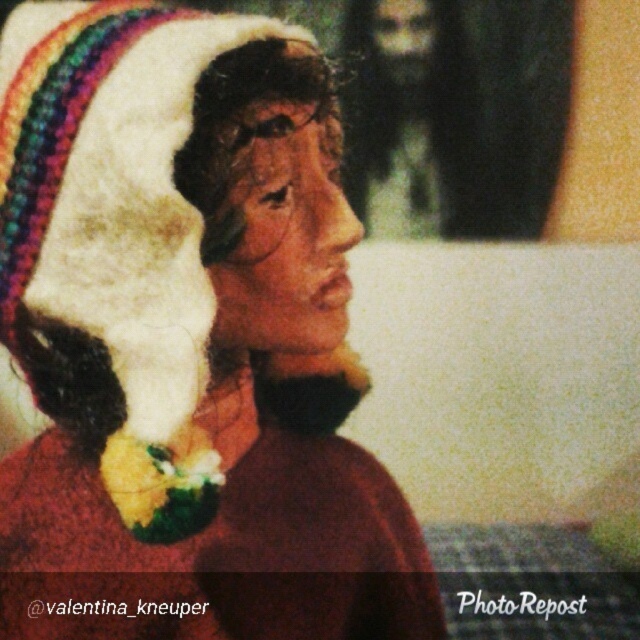
Question: Which of the following is the farthest from the observer?

Choices:
 (A) beige fabric head at upper center
 (B) bearded man at upper center

Answer: (A)

Question: Is bearded man at upper center positioned before beige fabric head at upper center?

Choices:
 (A) no
 (B) yes

Answer: (B)

Question: Is bearded man at upper center positioned behind beige fabric head at upper center?

Choices:
 (A) no
 (B) yes

Answer: (A)

Question: Estimate the real-world distances between objects in this image. Which object is farther from the white knitted hat at upper left?

Choices:
 (A) beige fabric head at upper center
 (B) bearded man at upper center

Answer: (A)

Question: Does bearded man at upper center appear on the right side of beige fabric head at upper center?

Choices:
 (A) no
 (B) yes

Answer: (B)

Question: Among these points, which one is nearest to the camera?

Choices:
 (A) (452, 12)
 (B) (298, 330)

Answer: (B)